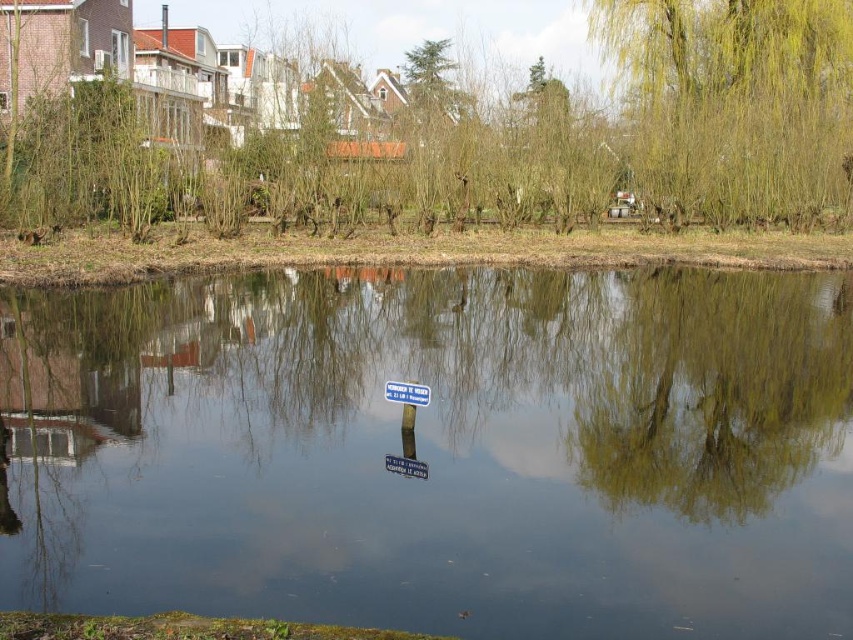
Question: Among these points, which one is nearest to the camera?

Choices:
 (A) (395, 120)
 (B) (200, 401)
 (C) (759, 38)

Answer: (B)

Question: Considering the real-world distances, which object is farthest from the green leafy tree at upper center?

Choices:
 (A) green willow tree at upper right
 (B) transparent glass water at center

Answer: (B)

Question: Does green leafy tree at upper center have a greater width compared to green willow tree at upper right?

Choices:
 (A) no
 (B) yes

Answer: (B)

Question: Is transparent glass water at center wider than green willow tree at upper right?

Choices:
 (A) yes
 (B) no

Answer: (A)

Question: Which point is farther from the camera taking this photo?

Choices:
 (A) (675, 154)
 (B) (518, 176)
 (C) (486, 352)

Answer: (B)

Question: Is transparent glass water at center further to the viewer compared to green leafy tree at upper center?

Choices:
 (A) yes
 (B) no

Answer: (B)